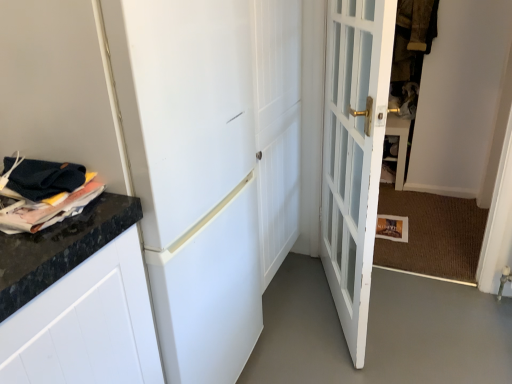
What is the approximate height of white glossy door at center, which is counted as the second door, starting from the right?

white glossy door at center, which is counted as the second door, starting from the right, is 4.40 feet in height.

The width and height of the screenshot is (512, 384). In order to click on white glass door at center, which is the 2th door in left-to-right order in this screenshot , I will do `click(354, 153)`.

From the image's perspective, is brown textured fabric at upper right located above or below white glossy door at center, which is counted as the second door, starting from the right?

Clearly, from the image's perspective, brown textured fabric at upper right is above white glossy door at center, which is counted as the second door, starting from the right.

From a real-world perspective, is brown textured fabric at upper right positioned above or below white glossy door at center, which is counted as the second door, starting from the right?

brown textured fabric at upper right is above white glossy door at center, which is counted as the second door, starting from the right.

Does brown textured fabric at upper right turn towards white glossy door at center, positioned as the 1th door in left-to-right order?

Yes, brown textured fabric at upper right is oriented towards white glossy door at center, positioned as the 1th door in left-to-right order.

Does white glass door at center, acting as the 1th door starting from the right, appear on the left side of white glossy door at center, positioned as the 1th door in left-to-right order?

No.

How much distance is there between white glass door at center, which is the 2th door in left-to-right order, and white glossy door at center, positioned as the 1th door in left-to-right order?

white glass door at center, which is the 2th door in left-to-right order, and white glossy door at center, positioned as the 1th door in left-to-right order, are 17.64 inches apart.

Is white glass door at center, acting as the 1th door starting from the right, with white glossy door at center, positioned as the 1th door in left-to-right order?

No.

From the image's perspective, which one is positioned lower, white glass door at center, acting as the 1th door starting from the right, or white glossy door at center, positioned as the 1th door in left-to-right order?

white glossy door at center, positioned as the 1th door in left-to-right order, from the image's perspective.

Considering the relative positions of white glossy door at center, which is counted as the second door, starting from the right, and white glass door at center, which is the 2th door in left-to-right order, in the image provided, is white glossy door at center, which is counted as the second door, starting from the right, to the left or to the right of white glass door at center, which is the 2th door in left-to-right order,?

From the image, it's evident that white glossy door at center, which is counted as the second door, starting from the right, is to the left of white glass door at center, which is the 2th door in left-to-right order.

Can you tell me how much white glossy door at center, which is counted as the second door, starting from the right, and white glass door at center, acting as the 1th door starting from the right, differ in facing direction?

23.8 degrees.

In terms of width, does white glossy door at center, which is counted as the second door, starting from the right, look wider or thinner when compared to white glass door at center, acting as the 1th door starting from the right?

Clearly, white glossy door at center, which is counted as the second door, starting from the right, has more width compared to white glass door at center, acting as the 1th door starting from the right.

Consider the image. Is matte black magazine at left at the left side of white glass door at center, acting as the 1th door starting from the right?

Correct, you'll find matte black magazine at left to the left of white glass door at center, acting as the 1th door starting from the right.

From a real-world perspective, is matte black magazine at left physically above white glass door at center, which is the 2th door in left-to-right order?

Correct, in the physical world, matte black magazine at left is higher than white glass door at center, which is the 2th door in left-to-right order.

How far apart are matte black magazine at left and white glass door at center, acting as the 1th door starting from the right?

They are 1.01 meters apart.

Is matte black magazine at left wider or thinner than white glass door at center, acting as the 1th door starting from the right?

In the image, matte black magazine at left appears to be wider than white glass door at center, acting as the 1th door starting from the right.

Find the location of a particular element. The width and height of the screenshot is (512, 384). door that appears in front of the matte black magazine at left is located at coordinates (195, 175).

Is the depth of white glossy door at center, which is counted as the second door, starting from the right, greater than that of matte black magazine at left?

No, it is not.

Can matte black magazine at left be found inside white glossy door at center, positioned as the 1th door in left-to-right order?

No, white glossy door at center, positioned as the 1th door in left-to-right order, does not contain matte black magazine at left.

Could you tell me if white glossy door at center, positioned as the 1th door in left-to-right order, is turned towards matte black magazine at left?

No, white glossy door at center, positioned as the 1th door in left-to-right order, does not turn towards matte black magazine at left.

Is matte black magazine at left oriented towards brown textured fabric at upper right?

No, matte black magazine at left is not turned towards brown textured fabric at upper right.

Considering the sizes of objects matte black magazine at left and brown textured fabric at upper right in the image provided, who is wider, matte black magazine at left or brown textured fabric at upper right?

With larger width is matte black magazine at left.

From a real-world perspective, which is physically above, matte black magazine at left or brown textured fabric at upper right?

From a 3D spatial view, brown textured fabric at upper right is above.

How distant is brown textured fabric at upper right from matte black magazine at left?

A distance of 2.21 meters exists between brown textured fabric at upper right and matte black magazine at left.

From their relative heights in the image, would you say brown textured fabric at upper right is taller or shorter than matte black magazine at left?

Clearly, brown textured fabric at upper right is taller compared to matte black magazine at left.

Is brown textured fabric at upper right bigger than matte black magazine at left?

Yes, brown textured fabric at upper right is bigger than matte black magazine at left.

Is brown textured fabric at upper right directly adjacent to matte black magazine at left?

No, brown textured fabric at upper right is not touching matte black magazine at left.

Locate an element on the screen. Image resolution: width=512 pixels, height=384 pixels. laundry above the white glossy door at center, positioned as the 1th door in left-to-right order (from the image's perspective) is located at coordinates (411, 49).

Where is `door that is under the white glossy door at center, positioned as the 1th door in left-to-right order (from a real-world perspective)`? Image resolution: width=512 pixels, height=384 pixels. door that is under the white glossy door at center, positioned as the 1th door in left-to-right order (from a real-world perspective) is located at coordinates (354, 153).

From the image, which object appears to be farther from white glossy door at center, which is counted as the second door, starting from the right, brown textured fabric at upper right or matte black magazine at left?

brown textured fabric at upper right.

Based on their spatial positions, is white glass door at center, which is the 2th door in left-to-right order, or matte black magazine at left closer to white glossy door at center, positioned as the 1th door in left-to-right order?

Based on the image, white glass door at center, which is the 2th door in left-to-right order, appears to be nearer to white glossy door at center, positioned as the 1th door in left-to-right order.

When comparing their distances from matte black magazine at left, does white glossy door at center, which is counted as the second door, starting from the right, or brown textured fabric at upper right seem further?

Based on the image, brown textured fabric at upper right appears to be further to matte black magazine at left.

From the image, which object appears to be nearer to brown textured fabric at upper right, white glass door at center, acting as the 1th door starting from the right, or matte black magazine at left?

white glass door at center, acting as the 1th door starting from the right, is closer to brown textured fabric at upper right.

Which object lies nearer to the anchor point brown textured fabric at upper right, matte black magazine at left or white glass door at center, which is the 2th door in left-to-right order?

white glass door at center, which is the 2th door in left-to-right order, lies closer to brown textured fabric at upper right than the other object.

When comparing their distances from white glass door at center, acting as the 1th door starting from the right, does matte black magazine at left or white glossy door at center, which is counted as the second door, starting from the right, seem further?

matte black magazine at left is positioned further to the anchor white glass door at center, acting as the 1th door starting from the right.

When comparing their distances from white glossy door at center, positioned as the 1th door in left-to-right order, does white glass door at center, acting as the 1th door starting from the right, or brown textured fabric at upper right seem further?

brown textured fabric at upper right is positioned further to the anchor white glossy door at center, positioned as the 1th door in left-to-right order.

Which object lies nearer to the anchor point matte black magazine at left, white glass door at center, acting as the 1th door starting from the right, or brown textured fabric at upper right?

white glass door at center, acting as the 1th door starting from the right.

Where is `magazine between white glossy door at center, positioned as the 1th door in left-to-right order, and brown textured fabric at upper right from front to back`? The image size is (512, 384). magazine between white glossy door at center, positioned as the 1th door in left-to-right order, and brown textured fabric at upper right from front to back is located at coordinates (47, 208).

Image resolution: width=512 pixels, height=384 pixels. Find the location of `door between matte black magazine at left and white glass door at center, acting as the 1th door starting from the right, in the horizontal direction`. door between matte black magazine at left and white glass door at center, acting as the 1th door starting from the right, in the horizontal direction is located at coordinates (195, 175).

This screenshot has width=512, height=384. Find the location of `door positioned between white glossy door at center, positioned as the 1th door in left-to-right order, and brown textured fabric at upper right from near to far`. door positioned between white glossy door at center, positioned as the 1th door in left-to-right order, and brown textured fabric at upper right from near to far is located at coordinates (354, 153).

Locate an element on the screen. The image size is (512, 384). door located between matte black magazine at left and brown textured fabric at upper right in the depth direction is located at coordinates (354, 153).